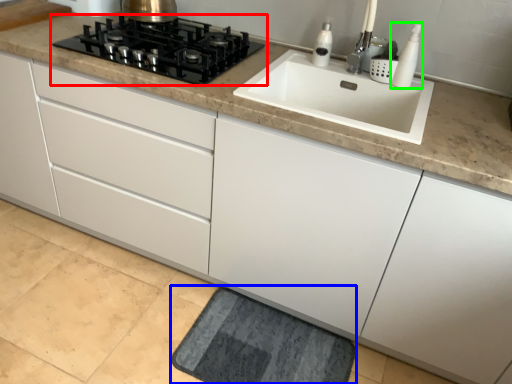
Question: Estimate the real-world distances between objects in this image. Which object is farther from gas stove (highlighted by a red box), bath mat (highlighted by a blue box) or soap dispenser (highlighted by a green box)?

Choices:
 (A) bath mat
 (B) soap dispenser

Answer: (A)